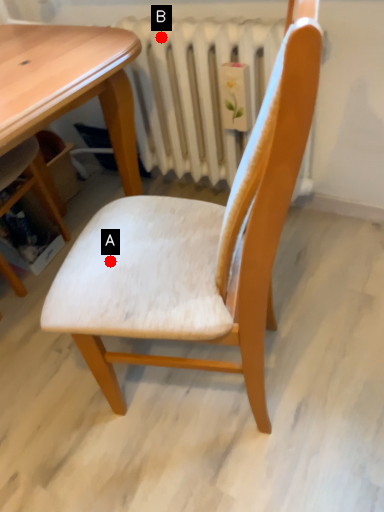
Question: Two points are circled on the image, labeled by A and B beside each circle. Which point is closer to the camera?

Choices:
 (A) A is closer
 (B) B is closer

Answer: (A)